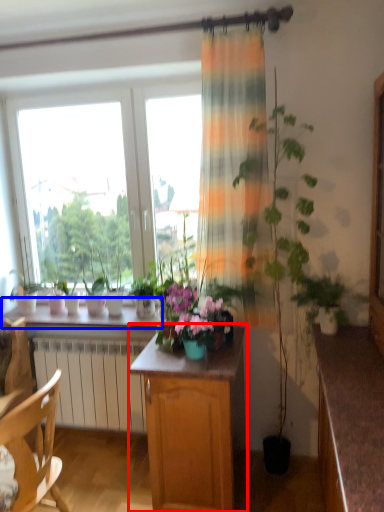
Question: Which of the following is the farthest to the observer, cabinetry (highlighted by a red box) or window sill (highlighted by a blue box)?

Choices:
 (A) cabinetry
 (B) window sill

Answer: (B)